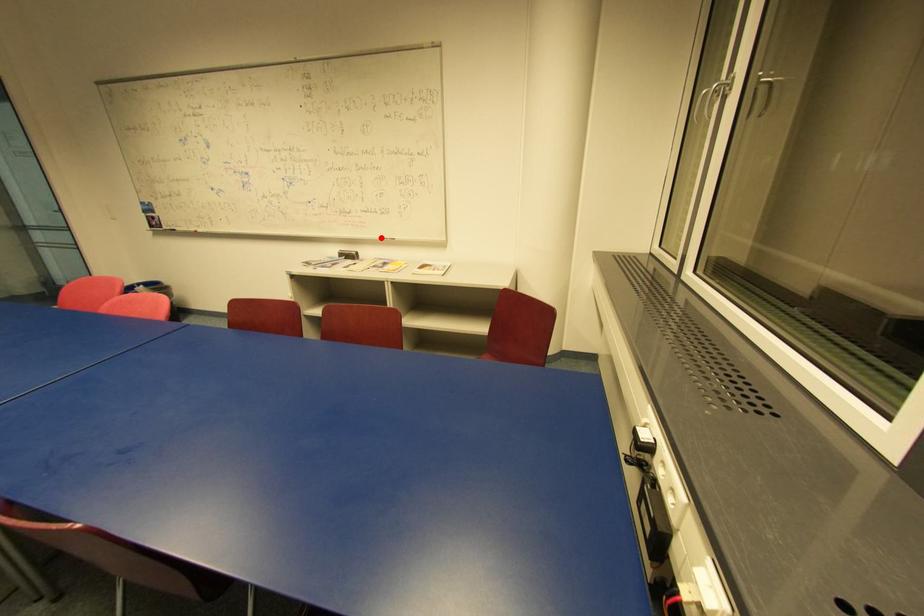
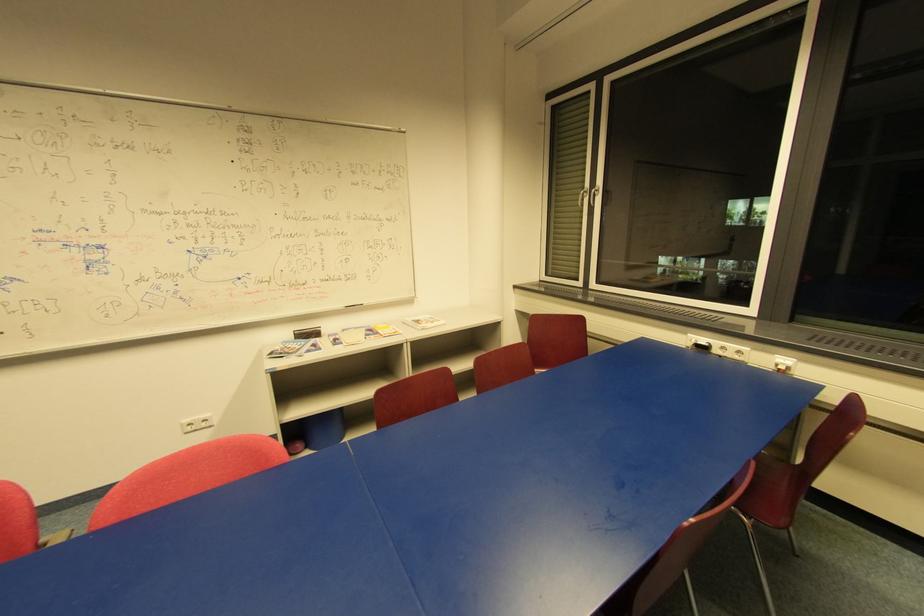
Question: I am providing you with two images of the same scene from different viewpoints. In image1, a red point is highlighted. Considering the same 3D point in image2, which of the following is correct?

Choices:
 (A) It is closer
 (B) It is farther

Answer: (B)